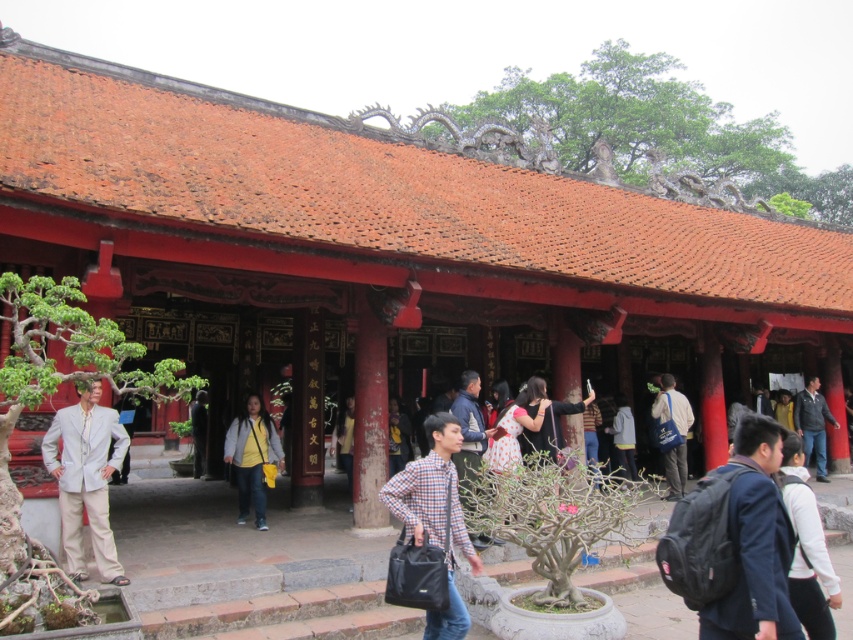
You are visiting this historical site and notice two yellow items at the center of the scene. Which one takes up more space, the yellow fabric backpack at center or the yellow fabric jacket at center?

The yellow fabric jacket at center takes up more space than the yellow fabric backpack at center.